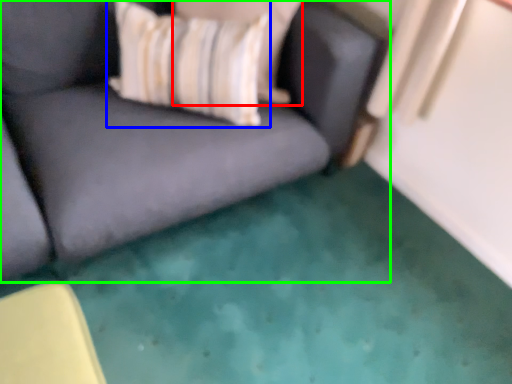
Question: Which object is positioned closest to pillow (highlighted by a red box)? Select from throw pillow (highlighted by a blue box) and studio couch (highlighted by a green box).

Choices:
 (A) throw pillow
 (B) studio couch

Answer: (A)